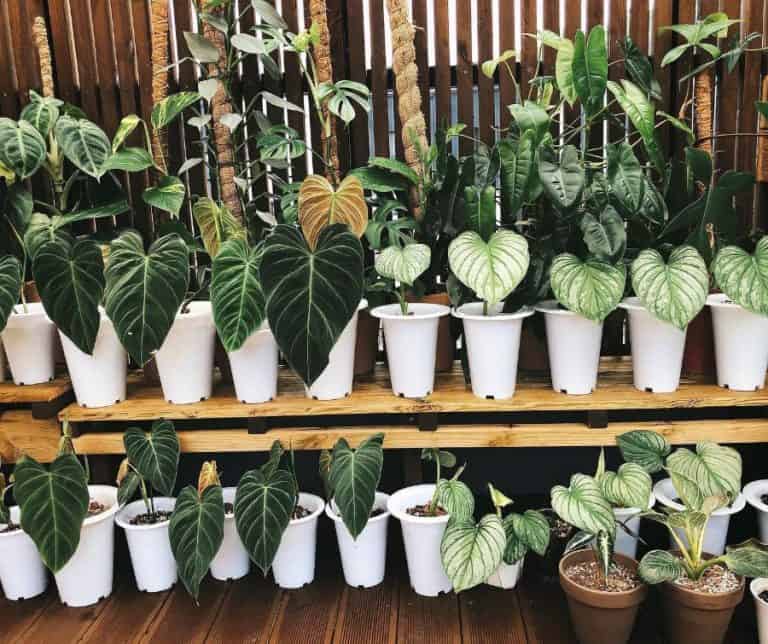
Find the location of a particular element. Image resolution: width=768 pixels, height=644 pixels. pot is located at coordinates (737, 357).